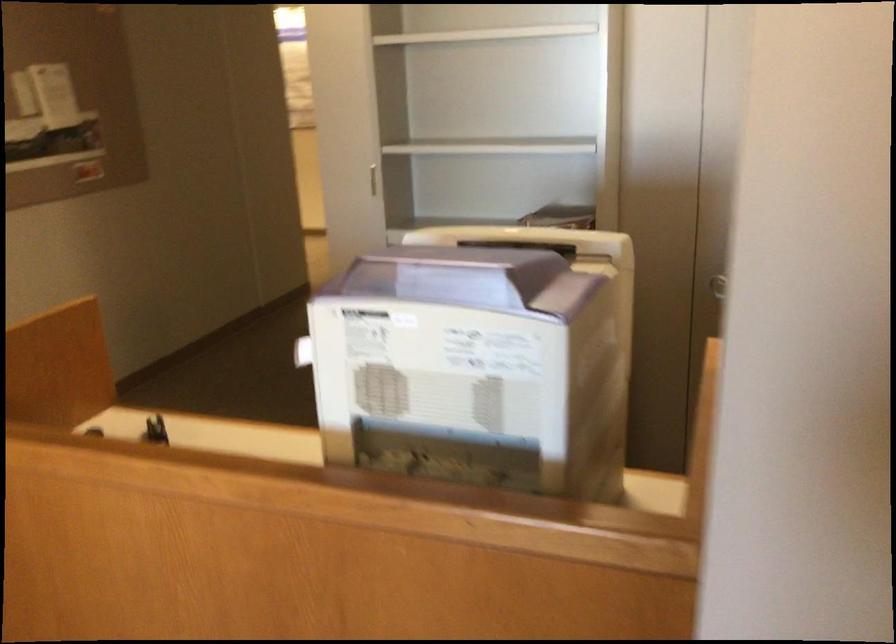
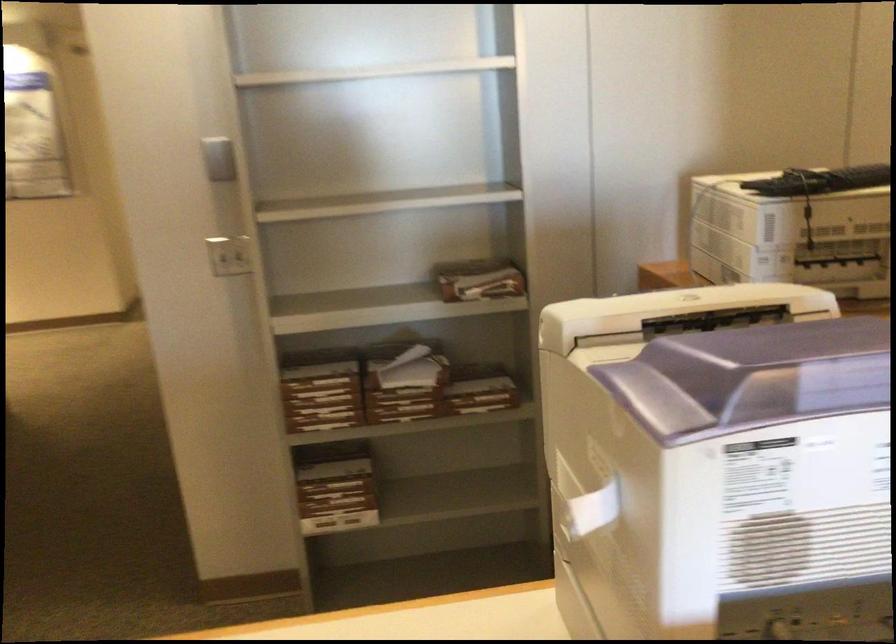
Find the pixel in the second image that matches pixel 376 90 in the first image.

(219, 158)